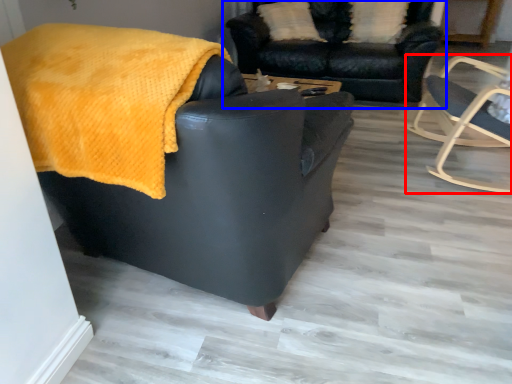
Question: Which object appears closest to the camera in this image, chair (highlighted by a red box) or studio couch (highlighted by a blue box)?

Choices:
 (A) chair
 (B) studio couch

Answer: (A)